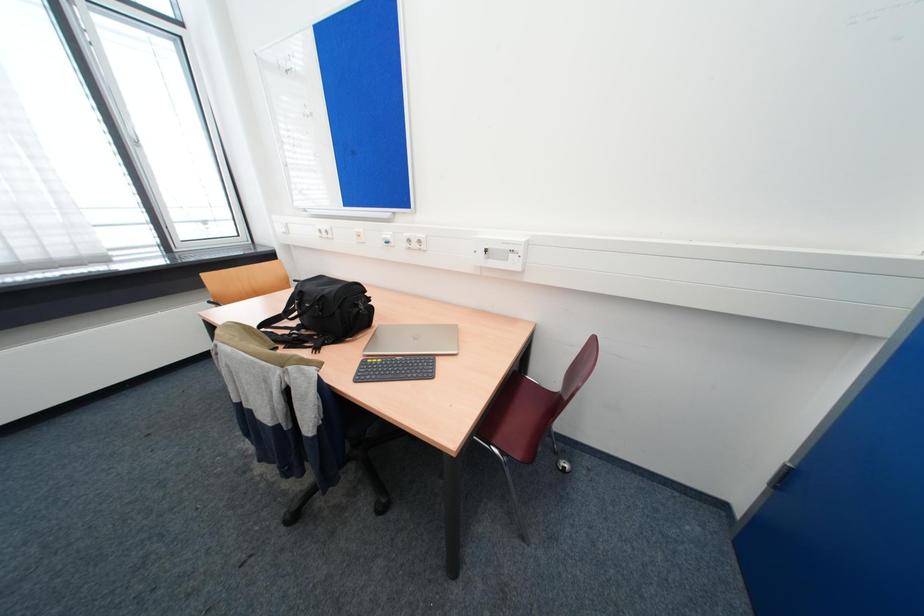
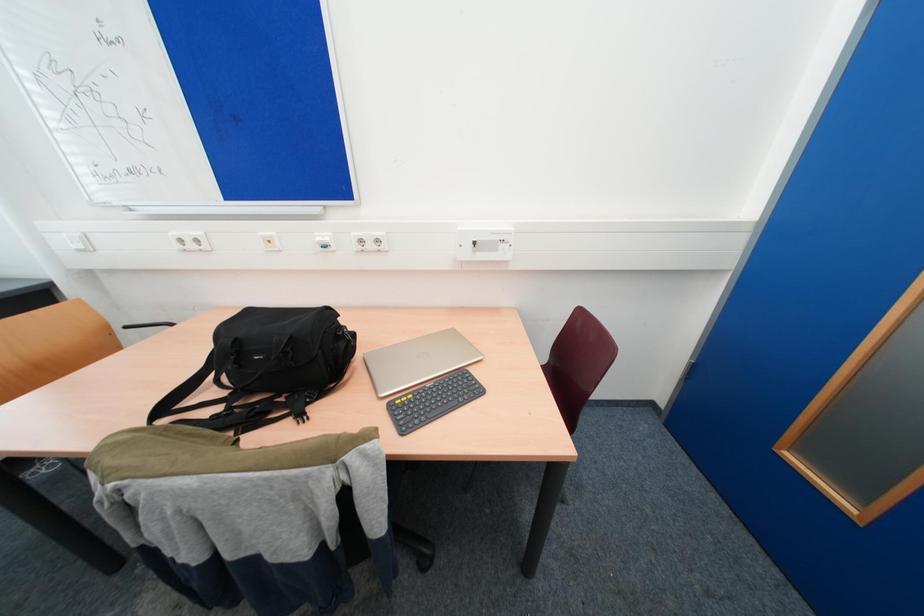
Which direction would the cameraman need to move to produce the second image?

The movement direction of the cameraman is left, forward.